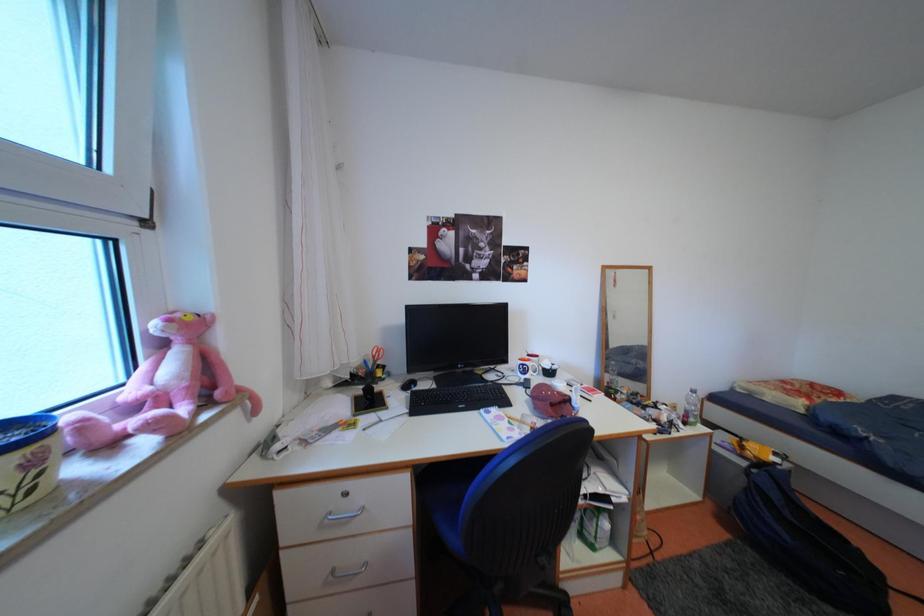
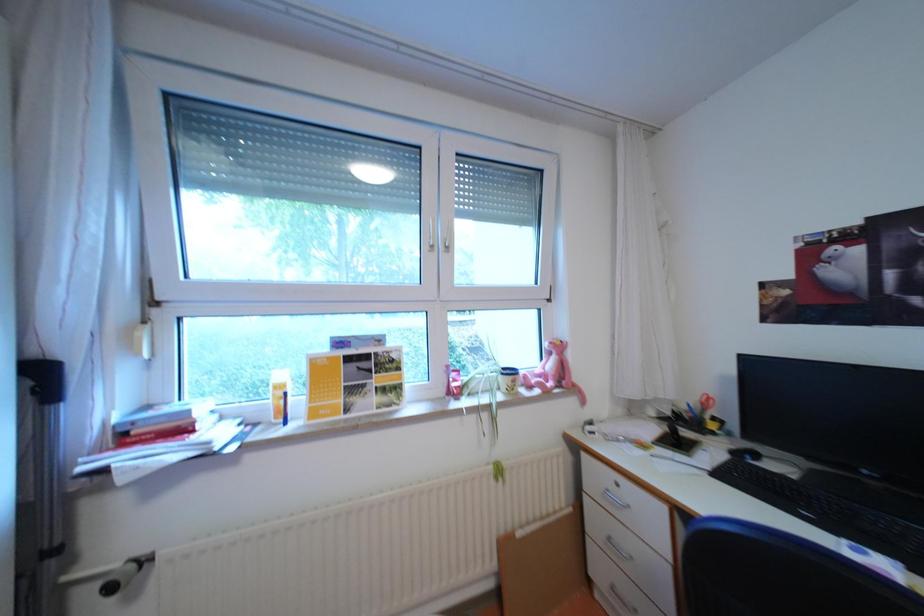
Question: The camera is either moving clockwise (left) or counter-clockwise (right) around the object. The first image is from the beginning of the video and the second image is from the end. Is the camera moving left or right when shooting the video?

Choices:
 (A) Left
 (B) Right

Answer: (B)